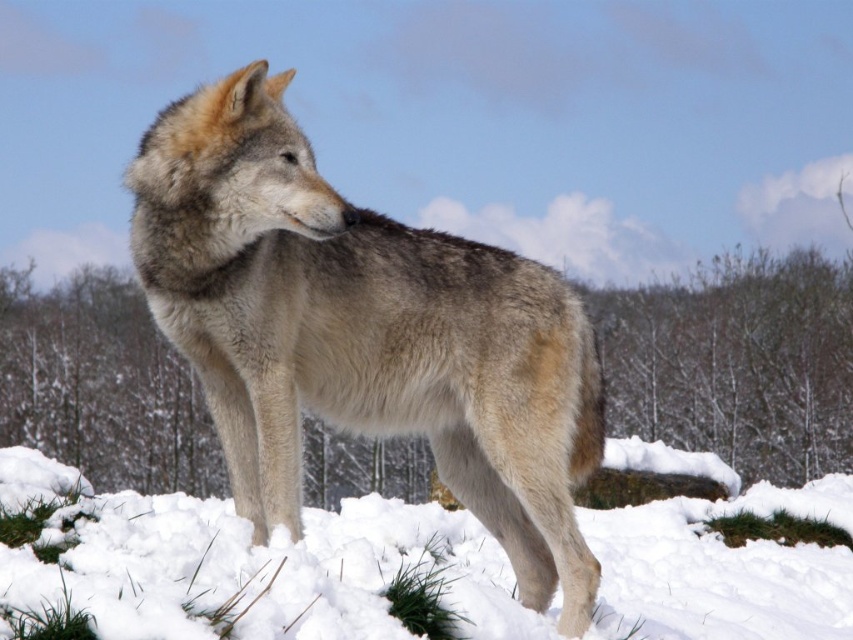
Image resolution: width=853 pixels, height=640 pixels. Describe the element at coordinates (363, 332) in the screenshot. I see `fuzzy fur wolf at center` at that location.

Does fuzzy fur wolf at center appear under white fluffy snow at lower center?

No.

Is point (448, 342) positioned after point (233, 624)?

Yes, point (448, 342) is farther from viewer.

The height and width of the screenshot is (640, 853). Find the location of `fuzzy fur wolf at center`. fuzzy fur wolf at center is located at coordinates (363, 332).